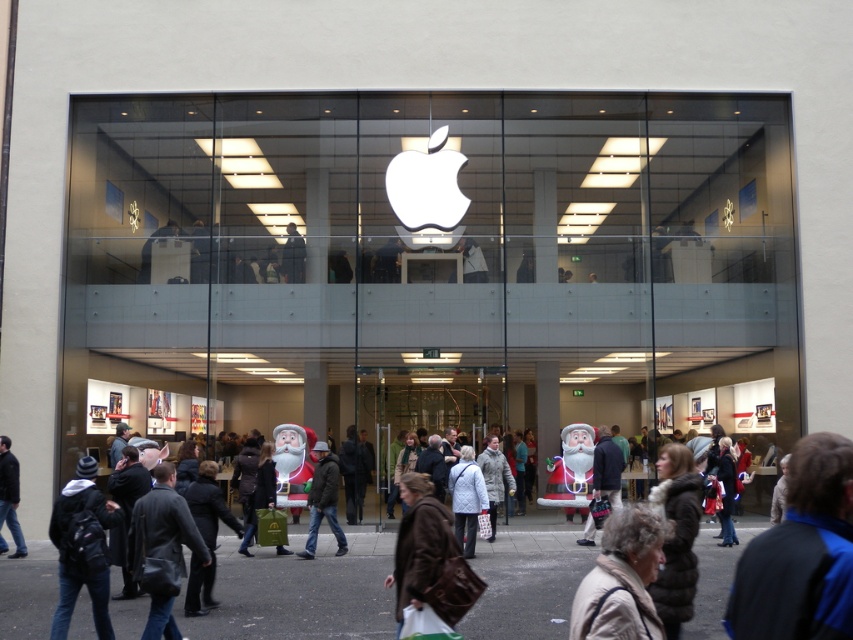
Question: Which of the following is the farthest from the observer?

Choices:
 (A) brown leather jacket at lower right
 (B) dark blue jeans at lower left

Answer: (B)

Question: Which point is farther from the camera taking this photo?

Choices:
 (A) (102, 609)
 (B) (309, 556)

Answer: (B)

Question: Which object is the farthest from the brown leather bag at center?

Choices:
 (A) dark gray jacket at lower left
 (B) dark brown leather jacket at center
 (C) brown leather jacket at lower right

Answer: (A)

Question: In this image, where is brown leather bag at center located relative to dark gray jacket at lower left?

Choices:
 (A) right
 (B) left

Answer: (A)

Question: Can you confirm if brown leather jacket at lower right is bigger than light brown leather jacket at lower right?

Choices:
 (A) no
 (B) yes

Answer: (B)

Question: Is the position of brown leather jacket at lower right less distant than that of dark gray jacket at lower left?

Choices:
 (A) yes
 (B) no

Answer: (A)